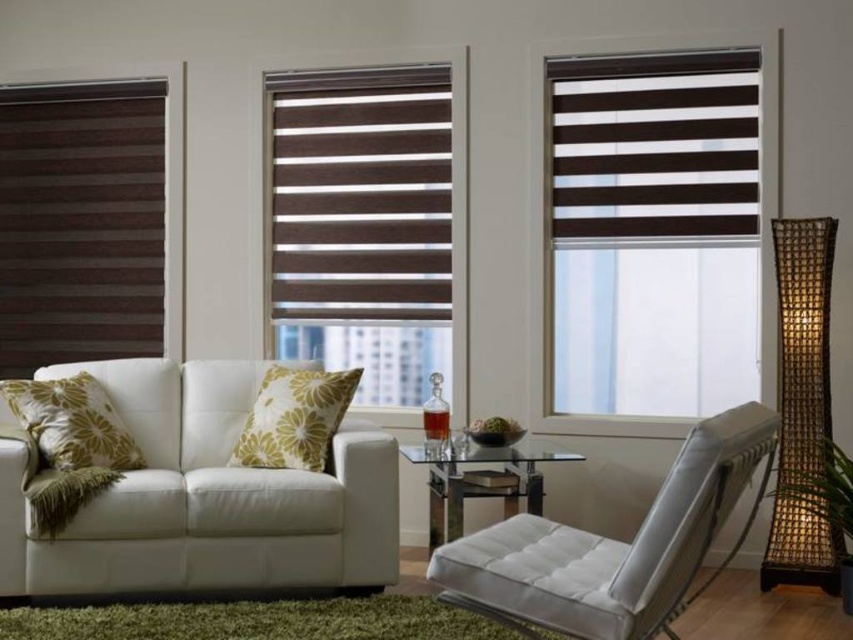
Question: Which of these objects is positioned closest to the clear glass table at center?

Choices:
 (A) brown striped blind at upper right
 (B) green floral pillow at left
 (C) white leather armchair at lower right

Answer: (C)

Question: Which object is the farthest from the brown wood blinds at left?

Choices:
 (A) clear glass table at center
 (B) white leather armchair at lower right

Answer: (B)

Question: Can you confirm if brown wood blinds at left is positioned below clear glass table at center?

Choices:
 (A) yes
 (B) no

Answer: (B)

Question: Which point is closer to the camera taking this photo?

Choices:
 (A) 51,432
 (B) 579,596

Answer: (B)

Question: Is white leather couch at lower left in front of green floral pillow at left?

Choices:
 (A) yes
 (B) no

Answer: (A)

Question: Is brown striped blind at upper right wider than clear glass table at center?

Choices:
 (A) no
 (B) yes

Answer: (B)